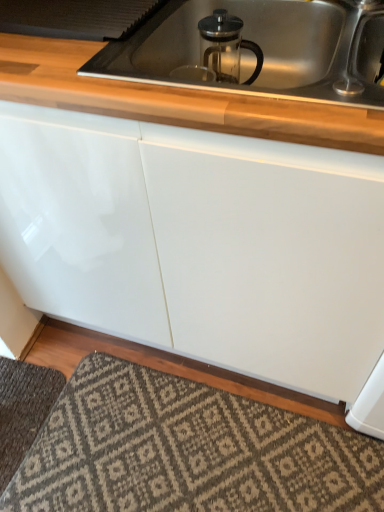
You are a GUI agent. You are given a task and a screenshot of the screen. Output one action in this format:
    pyautogui.click(x=<x>, y=<y>)
    Task: Click on the vacant space situated above dark gray textured rug at lower left, the 2th doormat from the right (from a real-world perspective)
    The image size is (384, 512).
    Given the screenshot: What is the action you would take?
    pyautogui.click(x=15, y=398)